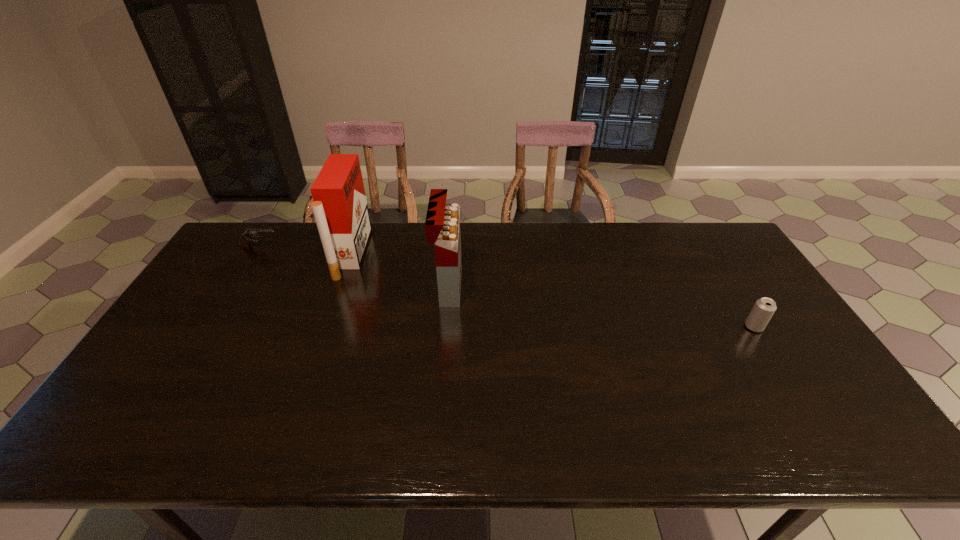
The image size is (960, 540). In order to click on the second object from left to right in this screenshot , I will do `click(340, 208)`.

Find the location of a particular element. the right cigarette case is located at coordinates (442, 226).

At what (x,y) coordinates should I click in order to perform the action: click on the nearest object. Please return your answer as a coordinate pair (x, y). This screenshot has height=540, width=960. Looking at the image, I should click on (764, 308).

The image size is (960, 540). I want to click on the third tallest object, so click(x=764, y=308).

At what (x,y) coordinates should I click in order to perform the action: click on the leftmost object. Please return your answer as a coordinate pair (x, y). Image resolution: width=960 pixels, height=540 pixels. Looking at the image, I should click on (247, 237).

Find the location of `pistol`. pistol is located at coordinates (247, 237).

You are a GUI agent. You are given a task and a screenshot of the screen. Output one action in this format:
    pyautogui.click(x=<x>, y=<y>)
    Task: Click on the free space located on the front-facing side of the left cigarette case
    
    Given the screenshot: What is the action you would take?
    pyautogui.click(x=391, y=254)

The height and width of the screenshot is (540, 960). I want to click on vacant position located with the lid open on the second object from right to left, so click(x=586, y=286).

I want to click on free space located on the left of the nearest object, so click(x=604, y=327).

Where is `vacant region located 0.210m at the barrel of the shortest object`? The width and height of the screenshot is (960, 540). vacant region located 0.210m at the barrel of the shortest object is located at coordinates (340, 247).